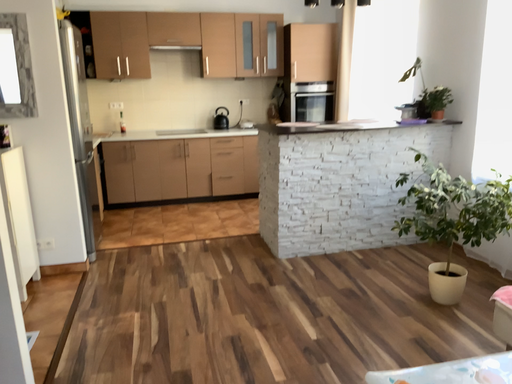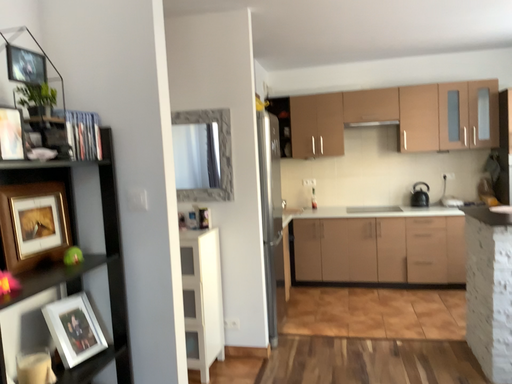
Question: How did the camera likely rotate when shooting the video?

Choices:
 (A) rotated upward
 (B) rotated downward

Answer: (A)